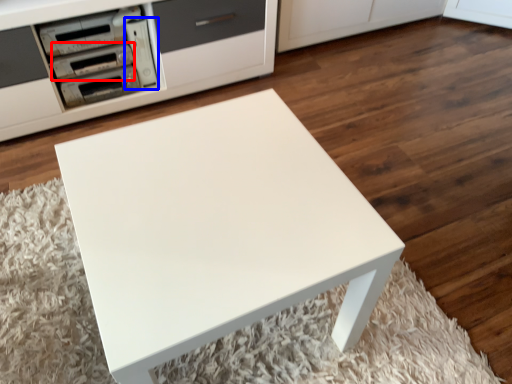
Question: Which of the following is the closest to the observer, appliance (highlighted by a red box) or appliance (highlighted by a blue box)?

Choices:
 (A) appliance
 (B) appliance

Answer: (A)